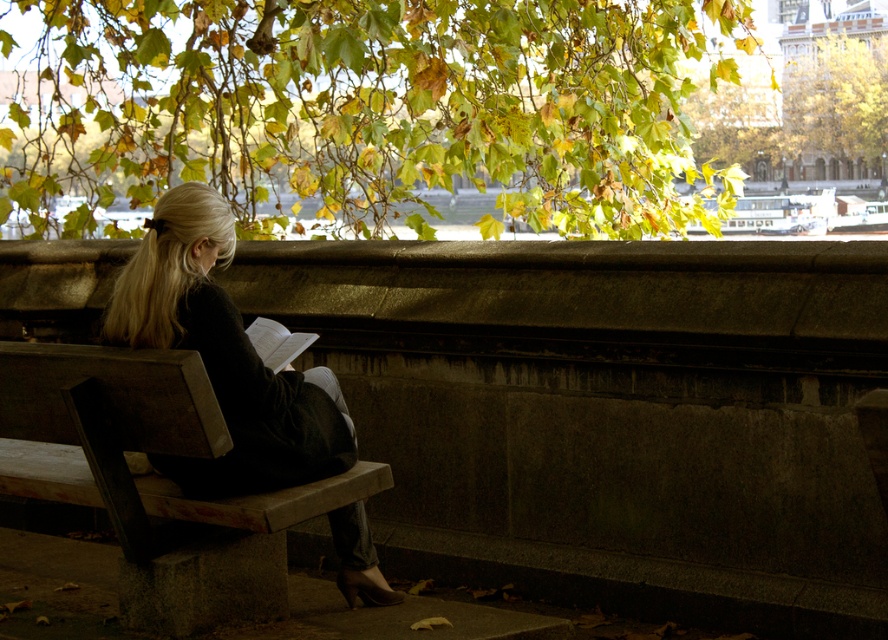
Question: Where is wooden bench at center located in relation to green leafy tree at upper center in the image?

Choices:
 (A) above
 (B) below

Answer: (B)

Question: Which point is farther to the camera?

Choices:
 (A) green leafy tree at upper center
 (B) black fabric jacket at left
 (C) wooden bench at center
 (D) green leafy branches at upper center

Answer: (A)

Question: Does wooden bench at center appear under green leafy tree at upper center?

Choices:
 (A) no
 (B) yes

Answer: (B)

Question: Which of the following is the closest to the observer?

Choices:
 (A) (147, 486)
 (B) (133, 324)

Answer: (B)

Question: Where is wooden bench at center located in relation to black fabric jacket at left in the image?

Choices:
 (A) above
 (B) below

Answer: (B)

Question: Which object is positioned closest to the green leafy branches at upper center?

Choices:
 (A) wooden bench at center
 (B) green leafy tree at upper center
 (C) black fabric jacket at left

Answer: (B)